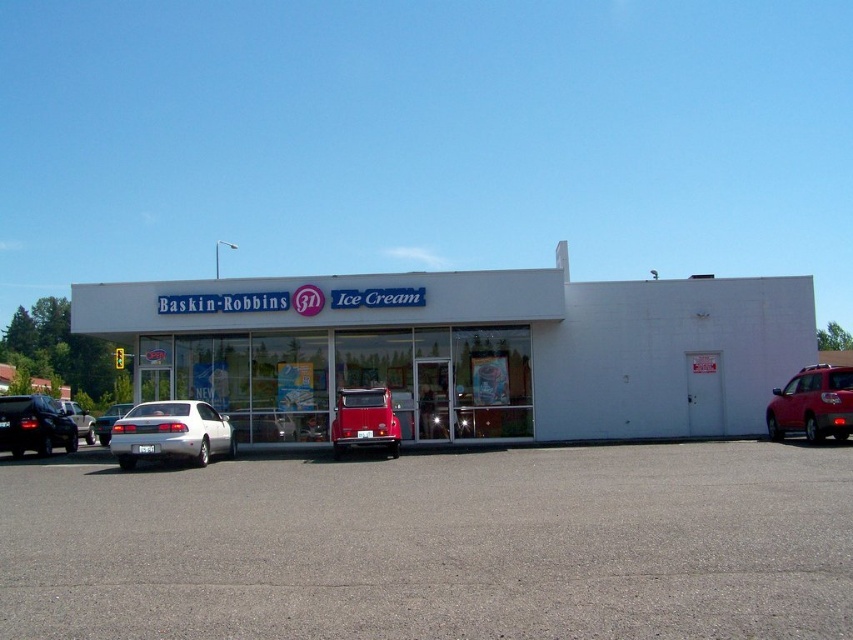
Question: Which point appears closest to the camera in this image?

Choices:
 (A) (169, 358)
 (B) (358, 410)
 (C) (329, 556)
 (D) (805, 404)

Answer: (C)

Question: Where is shiny red suv at right located in relation to silver metallic sedan at center-left in the image?

Choices:
 (A) below
 (B) above

Answer: (B)

Question: Based on their relative distances, which object is farther from the white glossy sedan at center?

Choices:
 (A) shiny red suv at right
 (B) silver metallic sedan at left
 (C) gray asphalt parking lot at lower center

Answer: (A)

Question: Does white matte building at center have a lesser width compared to silver metallic sedan at center-left?

Choices:
 (A) no
 (B) yes

Answer: (A)

Question: Which of the following is the farthest from the observer?

Choices:
 (A) shiny red suv at right
 (B) white matte building at center
 (C) white glossy sedan at center
 (D) silver metallic sedan at left

Answer: (D)

Question: Is gray asphalt parking lot at lower center positioned behind shiny black sedan at left?

Choices:
 (A) no
 (B) yes

Answer: (A)